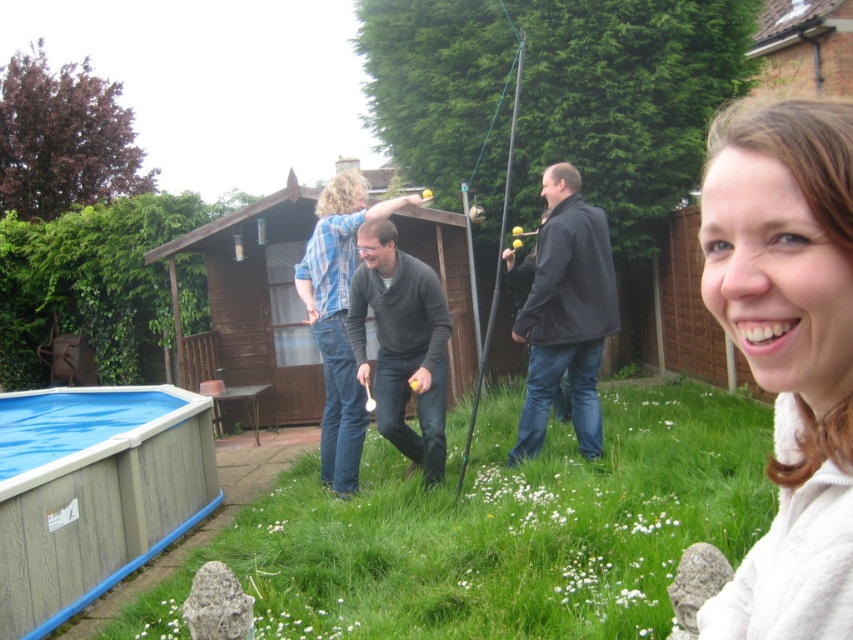
Question: From the image, what is the correct spatial relationship of white fleece sweater at upper right in relation to black matte jacket at center?

Choices:
 (A) left
 (B) right

Answer: (A)

Question: Can you confirm if white fleece sweater at upper right is positioned below matte gray sweater at center?

Choices:
 (A) no
 (B) yes

Answer: (A)

Question: Is white fleece sweater at upper right to the right of metallic silver fishing pole at center from the viewer's perspective?

Choices:
 (A) no
 (B) yes

Answer: (A)

Question: Considering the real-world distances, which object is farthest from the green grass at lower center?

Choices:
 (A) metallic silver fishing pole at center
 (B) white fleece sweater at upper right

Answer: (A)

Question: Which of the following is the closest to the observer?

Choices:
 (A) green grass at lower center
 (B) matte gray sweater at center

Answer: (A)

Question: Which point appears farthest from the camera in this image?

Choices:
 (A) (614, 508)
 (B) (596, 397)
 (C) (339, 438)
 (D) (78, 556)

Answer: (C)